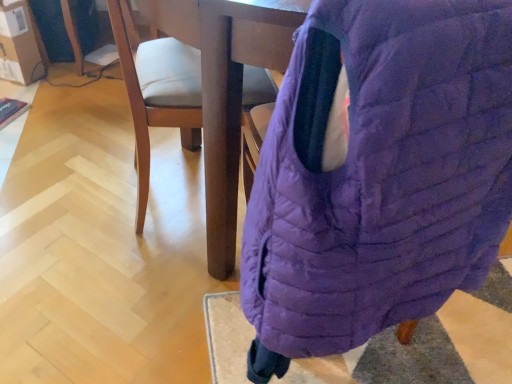
The image size is (512, 384). I want to click on purple quilted bean bag chair at center, so click(379, 175).

In order to face purple quilted bean bag chair at center, should I rotate leftwards or rightwards?

To face it directly, rotate right by 13.020 degrees.

Where is `light brown wood chair at center`? The height and width of the screenshot is (384, 512). light brown wood chair at center is located at coordinates (155, 89).

Do you think purple quilted bean bag chair at center is within matte brown cardboard at upper left, or outside of it?

purple quilted bean bag chair at center is spatially situated outside matte brown cardboard at upper left.

From the image's perspective, which object appears higher, purple quilted bean bag chair at center or matte brown cardboard at upper left?

matte brown cardboard at upper left is shown above in the image.

Which of these two, purple quilted bean bag chair at center or matte brown cardboard at upper left, stands taller?

With more height is purple quilted bean bag chair at center.

Is point (370, 183) positioned behind point (13, 10)?

No, it is not.

From the image's perspective, which object appears higher, light brown wood chair at center or purple quilted bean bag chair at center?

light brown wood chair at center appears higher in the image.

Is light brown wood chair at center next to purple quilted bean bag chair at center?

No, light brown wood chair at center is not with purple quilted bean bag chair at center.

Is light brown wood chair at center facing away from purple quilted bean bag chair at center?

light brown wood chair at center is not turned away from purple quilted bean bag chair at center.

Which of these two, light brown wood chair at center or purple quilted bean bag chair at center, is bigger?

Bigger between the two is purple quilted bean bag chair at center.

From the image's perspective, is matte brown cardboard at upper left on light brown wood chair at center?

Indeed, from the image's perspective, matte brown cardboard at upper left is shown above light brown wood chair at center.

Is point (25, 18) less distant than point (163, 116)?

No, it is behind (163, 116).

From the picture: Which of these two, matte brown cardboard at upper left or light brown wood chair at center, stands taller?

Standing taller between the two is light brown wood chair at center.

Is matte brown cardboard at upper left wider or thinner than light brown wood chair at center?

Clearly, matte brown cardboard at upper left has less width compared to light brown wood chair at center.

Measure the distance between light brown wood chair at center and matte brown cardboard at upper left.

They are 3.45 feet apart.

I want to click on cardboard box on the left of light brown wood chair at center, so click(x=18, y=44).

Based on the photo, is light brown wood chair at center completely or partially outside of matte brown cardboard at upper left?

Absolutely, light brown wood chair at center is external to matte brown cardboard at upper left.

Who is bigger, light brown wood chair at center or matte brown cardboard at upper left?

light brown wood chair at center is bigger.

Considering the relative sizes of matte brown cardboard at upper left and purple quilted bean bag chair at center in the image provided, is matte brown cardboard at upper left taller than purple quilted bean bag chair at center?

Incorrect, the height of matte brown cardboard at upper left is not larger of that of purple quilted bean bag chair at center.

Between point (35, 79) and point (257, 203), which one is positioned in front?

The point (257, 203) is more forward.

Which of these two, matte brown cardboard at upper left or purple quilted bean bag chair at center, is thinner?

With smaller width is matte brown cardboard at upper left.

Is purple quilted bean bag chair at center thinner than light brown wood chair at center?

No, purple quilted bean bag chair at center is not thinner than light brown wood chair at center.

Is point (473, 161) positioned before point (264, 95)?

Yes.

Where is `bean bag chair located below the light brown wood chair at center (from the image's perspective)`? The width and height of the screenshot is (512, 384). bean bag chair located below the light brown wood chair at center (from the image's perspective) is located at coordinates (379, 175).

From a real-world perspective, which is physically below, purple quilted bean bag chair at center or light brown wood chair at center?

In real-world perspective, light brown wood chair at center is lower.

At what (x,y) coordinates should I click in order to perform the action: click on cardboard box above the purple quilted bean bag chair at center (from the image's perspective). Please return your answer as a coordinate pair (x, y). Looking at the image, I should click on (18, 44).

I want to click on bean bag chair lying in front of the light brown wood chair at center, so click(x=379, y=175).

Estimate the real-world distances between objects in this image. Which object is further from purple quilted bean bag chair at center, light brown wood chair at center or matte brown cardboard at upper left?

Based on the image, matte brown cardboard at upper left appears to be further to purple quilted bean bag chair at center.

Considering their positions, is purple quilted bean bag chair at center positioned further to matte brown cardboard at upper left than light brown wood chair at center?

purple quilted bean bag chair at center.

Based on the photo, estimate the real-world distances between objects in this image. Which object is closer to light brown wood chair at center, purple quilted bean bag chair at center or matte brown cardboard at upper left?

Among the two, purple quilted bean bag chair at center is located nearer to light brown wood chair at center.

Looking at this image, looking at the image, which one is located further to light brown wood chair at center, matte brown cardboard at upper left or purple quilted bean bag chair at center?

Based on the image, matte brown cardboard at upper left appears to be further to light brown wood chair at center.

In the scene shown: Estimate the real-world distances between objects in this image. Which object is closer to matte brown cardboard at upper left, light brown wood chair at center or purple quilted bean bag chair at center?

Based on the image, light brown wood chair at center appears to be nearer to matte brown cardboard at upper left.

Based on their spatial positions, is matte brown cardboard at upper left or light brown wood chair at center further from purple quilted bean bag chair at center?

Among the two, matte brown cardboard at upper left is located further to purple quilted bean bag chair at center.

The width and height of the screenshot is (512, 384). Identify the location of chair between matte brown cardboard at upper left and purple quilted bean bag chair at center from left to right. (155, 89).